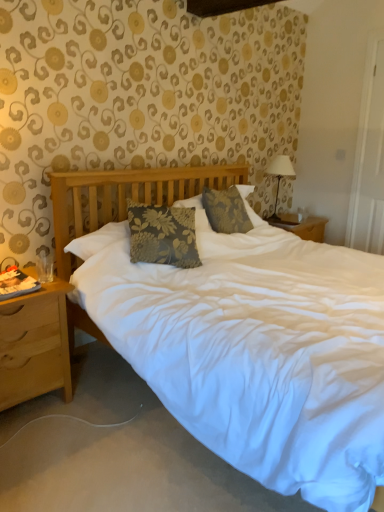
Locate an element on the screen. This screenshot has height=512, width=384. white fabric-covered lampshade at upper right is located at coordinates (280, 172).

Identify the location of wooden nightstand at left. The width and height of the screenshot is (384, 512). (34, 345).

I want to click on white fabric-covered lampshade at upper right, so click(280, 172).

Is wooden nightstand at left inside floral fabric pillow at center?

No, floral fabric pillow at center does not contain wooden nightstand at left.

Does floral fabric pillow at center have a smaller size compared to wooden nightstand at left?

Indeed, floral fabric pillow at center has a smaller size compared to wooden nightstand at left.

Is floral fabric pillow at center taller than wooden nightstand at left?

In fact, floral fabric pillow at center may be shorter than wooden nightstand at left.

Can you confirm if floral fabric pillow at center is thinner than wooden nightstand at left?

Yes, floral fabric pillow at center is thinner than wooden nightstand at left.

Looking at this image, which of these two, floral fabric pillow at center or white fabric-covered lampshade at upper right, is bigger?

Bigger between the two is floral fabric pillow at center.

Between floral fabric pillow at center and white fabric-covered lampshade at upper right, which one is positioned in front?

floral fabric pillow at center is closer to the camera.

Does floral fabric pillow at center have a lesser height compared to white fabric-covered lampshade at upper right?

Indeed, floral fabric pillow at center has a lesser height compared to white fabric-covered lampshade at upper right.

Considering the positions of objects floral fabric pillow at center and white fabric-covered lampshade at upper right in the image provided, who is more to the right, floral fabric pillow at center or white fabric-covered lampshade at upper right?

From the viewer's perspective, white fabric-covered lampshade at upper right appears more on the right side.

Between wooden nightstand at left and floral fabric pillow at center, which one has smaller width?

floral fabric pillow at center.

Is wooden nightstand at left at the left side of floral fabric pillow at center?

Correct, you'll find wooden nightstand at left to the left of floral fabric pillow at center.

Which of these two, wooden nightstand at left or floral fabric pillow at center, stands taller?

Standing taller between the two is wooden nightstand at left.

Does wooden nightstand at left come behind floral fabric pillow at center?

No, it is in front of floral fabric pillow at center.

From a real-world perspective, which object stands above the other?

white fabric-covered lampshade at upper right is physically above.

Considering the points (274, 215) and (14, 334), which point is behind, point (274, 215) or point (14, 334)?

The point (274, 215) is behind.

Is wooden nightstand at left surrounded by white fabric-covered lampshade at upper right?

No, wooden nightstand at left is not a part of white fabric-covered lampshade at upper right.

Could you tell me if white fabric-covered lampshade at upper right is turned towards wooden nightstand at left?

No, white fabric-covered lampshade at upper right is not aimed at wooden nightstand at left.

Measure the distance from white fabric-covered lampshade at upper right to floral fabric pillow at center.

white fabric-covered lampshade at upper right is 18.44 inches away from floral fabric pillow at center.

Is white fabric-covered lampshade at upper right located outside floral fabric pillow at center?

Yes, white fabric-covered lampshade at upper right is outside of floral fabric pillow at center.

Is white fabric-covered lampshade at upper right bigger than floral fabric pillow at center?

Actually, white fabric-covered lampshade at upper right might be smaller than floral fabric pillow at center.

Is wooden nightstand at left far away from white fabric-covered lampshade at upper right?

Absolutely, wooden nightstand at left is distant from white fabric-covered lampshade at upper right.

From the image's perspective, is wooden nightstand at left under white fabric-covered lampshade at upper right?

Indeed, from the image's perspective, wooden nightstand at left is shown beneath white fabric-covered lampshade at upper right.

Between point (7, 377) and point (290, 160), which one is positioned in front?

The point (7, 377) is in front.

Where is `nightstand in front of the floral fabric pillow at center`? The width and height of the screenshot is (384, 512). nightstand in front of the floral fabric pillow at center is located at coordinates (34, 345).

This screenshot has height=512, width=384. Identify the location of pillow that is under the white fabric-covered lampshade at upper right (from a real-world perspective). (249, 205).

Considering their positions, is white fabric-covered lampshade at upper right positioned closer to wooden nightstand at left than floral fabric pillow at center?

floral fabric pillow at center.

Estimate the real-world distances between objects in this image. Which object is closer to wooden nightstand at left, floral fabric pillow at center or white fabric-covered lampshade at upper right?

floral fabric pillow at center is positioned closer to the anchor wooden nightstand at left.

Looking at this image, looking at the image, which one is located closer to floral fabric pillow at center, wooden nightstand at left or white fabric-covered lampshade at upper right?

The object closer to floral fabric pillow at center is white fabric-covered lampshade at upper right.

When comparing their distances from floral fabric pillow at center, does white fabric-covered lampshade at upper right or wooden nightstand at left seem closer?

white fabric-covered lampshade at upper right is positioned closer to the anchor floral fabric pillow at center.

Estimate the real-world distances between objects in this image. Which object is closer to white fabric-covered lampshade at upper right, wooden nightstand at left or floral fabric pillow at center?

The object closer to white fabric-covered lampshade at upper right is floral fabric pillow at center.

Which object lies nearer to the anchor point white fabric-covered lampshade at upper right, floral fabric pillow at center or wooden nightstand at left?

The object closer to white fabric-covered lampshade at upper right is floral fabric pillow at center.

Identify the location of pillow between wooden nightstand at left and white fabric-covered lampshade at upper right in the horizontal direction. This screenshot has height=512, width=384. (249, 205).